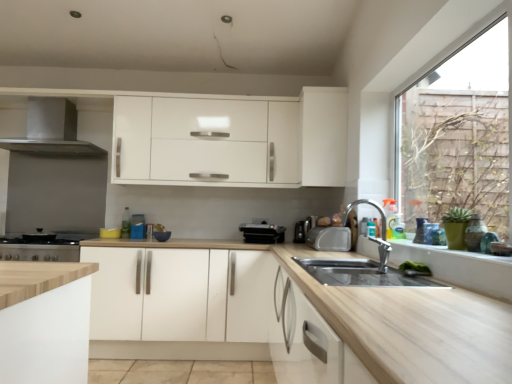
Question: From the image's perspective, is white matte cabinet at center, which appears as the 2th cabinetry when viewed from the top, below satin silver exhaust hood at left?

Choices:
 (A) no
 (B) yes

Answer: (B)

Question: Is white matte cabinet at center, marked as the 1th cabinetry in a left-to-right arrangement, further to camera compared to satin silver exhaust hood at left?

Choices:
 (A) no
 (B) yes

Answer: (A)

Question: Is white matte cabinet at center, which appears as the 2th cabinetry when viewed from the top, smaller than satin silver exhaust hood at left?

Choices:
 (A) yes
 (B) no

Answer: (B)

Question: Does white matte cabinet at center, marked as the second cabinetry in a right-to-left arrangement, have a greater width compared to satin silver exhaust hood at left?

Choices:
 (A) yes
 (B) no

Answer: (A)

Question: Is white matte cabinet at center, marked as the second cabinetry in a right-to-left arrangement, oriented away from satin silver exhaust hood at left?

Choices:
 (A) no
 (B) yes

Answer: (A)

Question: Can you confirm if white matte cabinet at center, marked as the 1th cabinetry in a left-to-right arrangement, is bigger than satin silver exhaust hood at left?

Choices:
 (A) yes
 (B) no

Answer: (A)

Question: From a real-world perspective, is satin black toaster at center, the third appliance in the right-to-left sequence, located higher than black plastic toaster at center, the second appliance in the left-to-right sequence?

Choices:
 (A) no
 (B) yes

Answer: (B)

Question: Can you confirm if satin black toaster at center, the third appliance in the right-to-left sequence, is taller than black plastic toaster at center, the second appliance in the left-to-right sequence?

Choices:
 (A) no
 (B) yes

Answer: (B)

Question: Does satin black toaster at center, the third appliance in the right-to-left sequence, have a lesser width compared to black plastic toaster at center, which appears as the fourth appliance when viewed from the right?

Choices:
 (A) no
 (B) yes

Answer: (B)

Question: Can you confirm if satin black toaster at center, the third appliance in the right-to-left sequence, is bigger than black plastic toaster at center, the second appliance in the left-to-right sequence?

Choices:
 (A) yes
 (B) no

Answer: (B)

Question: Can you confirm if satin black toaster at center, positioned as the third appliance in left-to-right order, is shorter than black plastic toaster at center, which appears as the fourth appliance when viewed from the right?

Choices:
 (A) yes
 (B) no

Answer: (B)

Question: Is satin black toaster at center, the third appliance in the right-to-left sequence, not close to black plastic toaster at center, which appears as the fourth appliance when viewed from the right?

Choices:
 (A) no
 (B) yes

Answer: (A)

Question: Considering the relative sizes of satin silver exhaust hood at left and white matte cabinet at upper center, the 1th cabinetry viewed from the top, in the image provided, is satin silver exhaust hood at left shorter than white matte cabinet at upper center, the 1th cabinetry viewed from the top,?

Choices:
 (A) no
 (B) yes

Answer: (B)